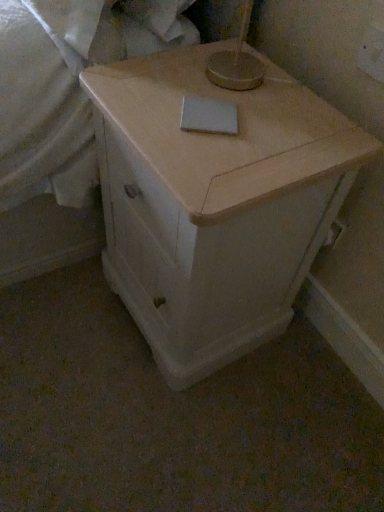
Locate an element on the screen. The height and width of the screenshot is (512, 384). vacant area to the left of white matte notepad at center is located at coordinates (147, 95).